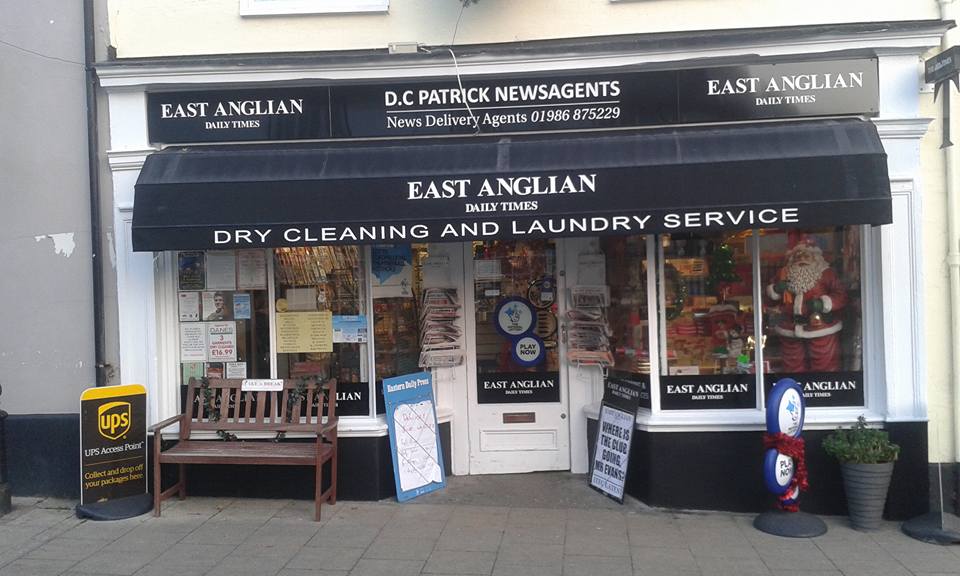
Locate an element on the screen. Image resolution: width=960 pixels, height=576 pixels. gray decorative planter is located at coordinates (867, 484).